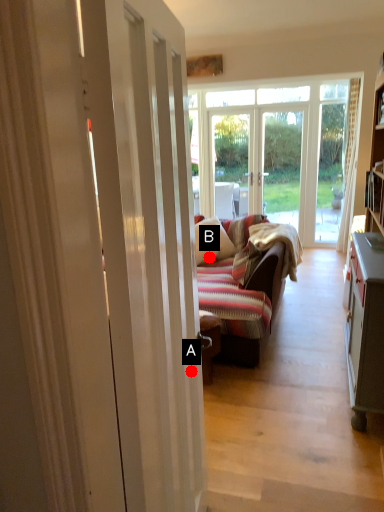
Question: Two points are circled on the image, labeled by A and B beside each circle. Which point is closer to the camera?

Choices:
 (A) A is closer
 (B) B is closer

Answer: (A)